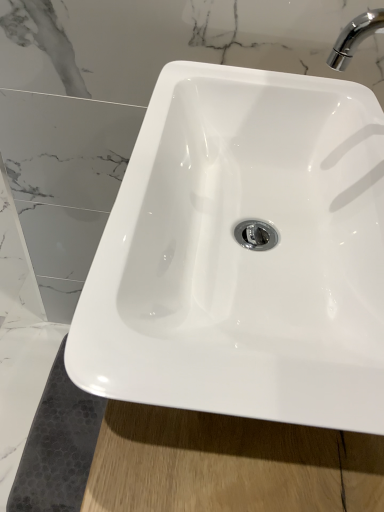
What do you see at coordinates (244, 254) in the screenshot?
I see `white glossy sink at center` at bounding box center [244, 254].

What are the coordinates of `white glossy sink at center` in the screenshot? It's located at (244, 254).

Identify the location of white glossy sink at center. Image resolution: width=384 pixels, height=512 pixels. (244, 254).